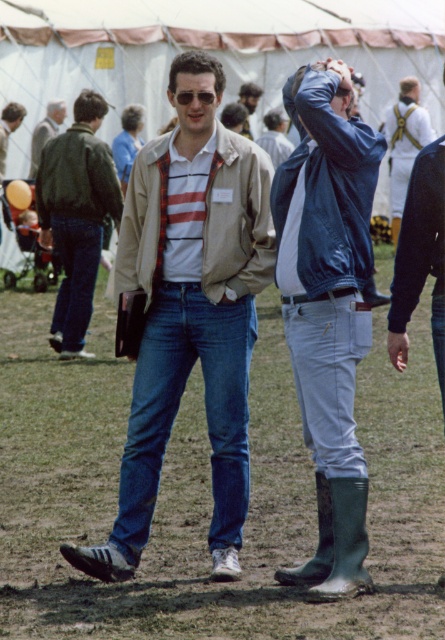
You are a photographer at the fair and want to capture both the light gray cotton pants at lower center and the white matte uniform at upper center in the same frame. Which direction should you pan your camera to include both?

To include both the light gray cotton pants at lower center and the white matte uniform at upper center in the same frame, pan your camera to the right since the light gray cotton pants at lower center are to the left of the white matte uniform at upper center.

You are standing at the fair and see the light gray cotton pants at lower center and the white matte uniform at upper center. How far apart are they?

The light gray cotton pants at lower center and the white matte uniform at upper center are 13.12 meters apart from each other.

You are a photographer trying to capture the light gray cotton pants at lower center and the blue denim jeans at center in the same frame. Which of these two items is positioned lower in the image?

The light gray cotton pants at lower center is positioned lower than the blue denim jeans at center.